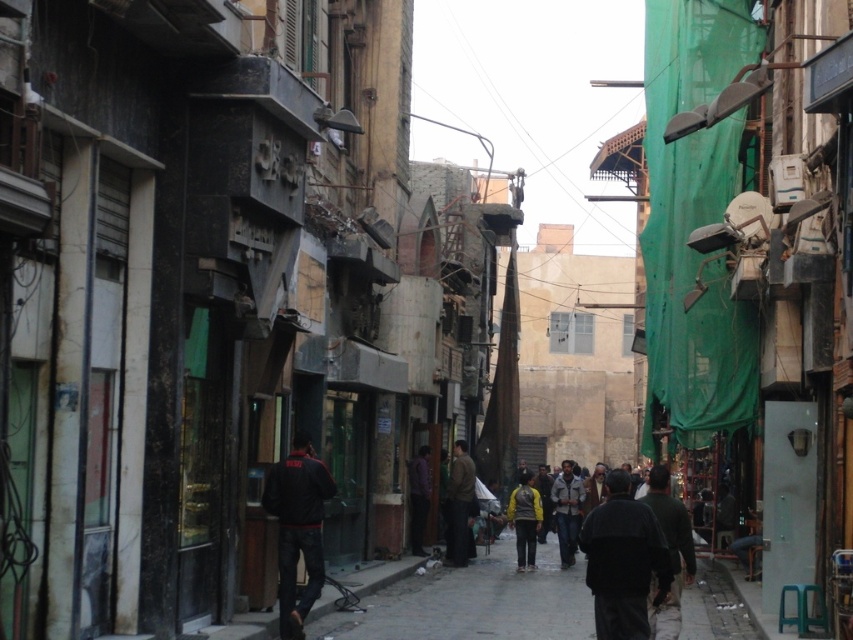
Between yellow-green jacket at center and light gray fabric jacket at center, which one appears on the right side from the viewer's perspective?

Positioned to the right is light gray fabric jacket at center.

Is yellow-green jacket at center positioned in front of light gray fabric jacket at center?

Yes, it is.

The width and height of the screenshot is (853, 640). What do you see at coordinates (524, 518) in the screenshot?
I see `yellow-green jacket at center` at bounding box center [524, 518].

Locate an element on the screen. yellow-green jacket at center is located at coordinates (524, 518).

Can you confirm if gray concrete pavement at center is positioned above purple matte shirt at center?

No.

Based on the photo, does gray concrete pavement at center appear under purple matte shirt at center?

Correct, gray concrete pavement at center is located below purple matte shirt at center.

Which is behind, point (563, 612) or point (426, 502)?

The point (426, 502) is behind.

You are a GUI agent. You are given a task and a screenshot of the screen. Output one action in this format:
    pyautogui.click(x=<x>, y=<y>)
    Task: Click on the gray concrete pavement at center
    The height and width of the screenshot is (640, 853).
    Given the screenshot: What is the action you would take?
    pyautogui.click(x=474, y=604)

Is gray concrete pavement at center further to the viewer compared to light gray fabric jacket at center?

No, gray concrete pavement at center is closer to the viewer.

Is gray concrete pavement at center bigger than light gray fabric jacket at center?

Yes.

Between point (531, 634) and point (566, 493), which one is positioned behind?

Point (566, 493)

Locate an element on the screen. gray concrete pavement at center is located at coordinates (474, 604).